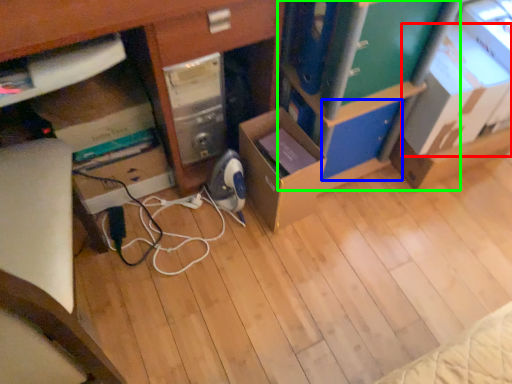
Question: Based on their relative distances, which object is nearer to cardboard box (highlighted by a red box)? Choose from drawer (highlighted by a blue box) and bookshelf (highlighted by a green box).

Choices:
 (A) drawer
 (B) bookshelf

Answer: (A)